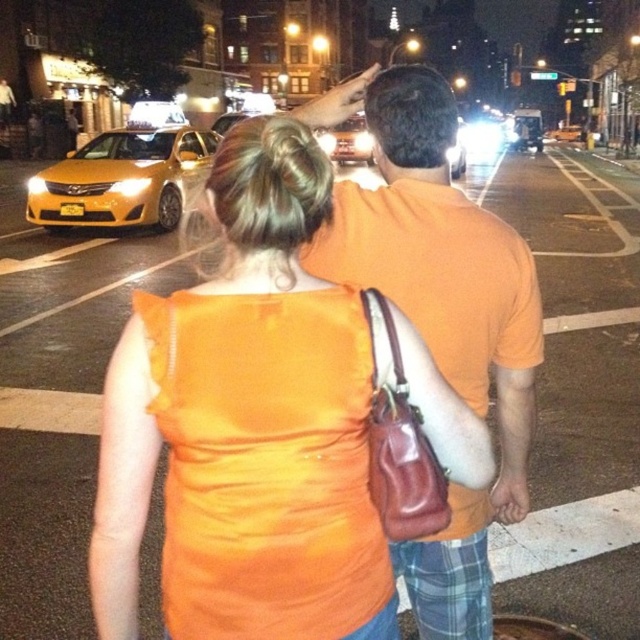
Question: Estimate the real-world distances between objects in this image. Which object is farther from the orange matte shirt at center?

Choices:
 (A) shiny silver car at center
 (B) orange satin dress at center

Answer: (A)

Question: Which object appears closest to the camera in this image?

Choices:
 (A) shiny silver car at center
 (B) yellow matte taxi at left

Answer: (A)

Question: Where is orange satin dress at center located in relation to orange matte shirt at center in the image?

Choices:
 (A) left
 (B) right

Answer: (A)

Question: Is orange satin dress at center smaller than orange matte shirt at center?

Choices:
 (A) no
 (B) yes

Answer: (A)

Question: Is orange satin dress at center closer to the viewer compared to yellow matte taxi at left?

Choices:
 (A) yes
 (B) no

Answer: (A)

Question: Which point is farther to the camera?

Choices:
 (A) yellow matte taxi at left
 (B) shiny silver car at center

Answer: (A)